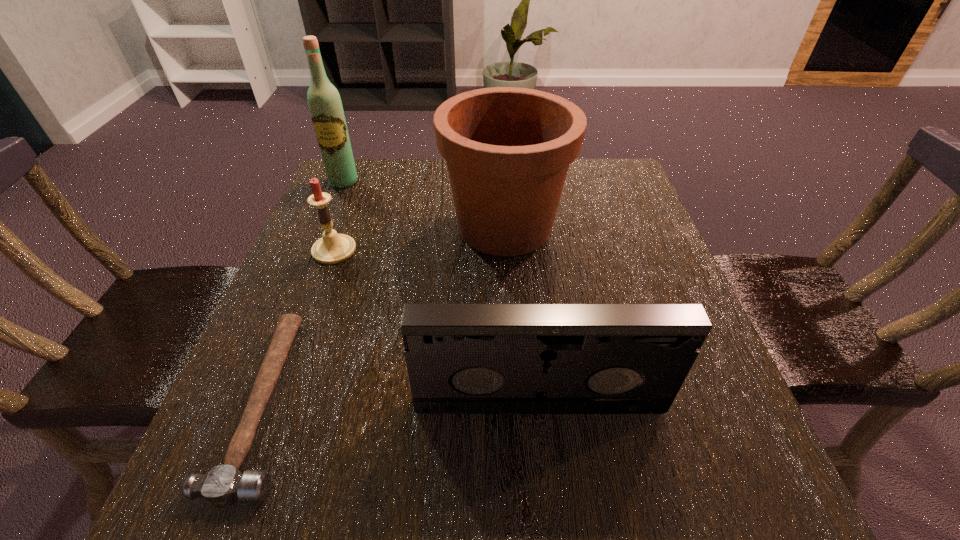
Find the location of a particular element. This screenshot has width=960, height=540. object that stands as the third closest to the wine bottle is located at coordinates pos(223,485).

Identify which object is the second closest to the shortest object. Please provide its 2D coordinates. Your answer should be formatted as a tuple, i.e. [(x, y)], where the tuple contains the x and y coordinates of a point satisfying the conditions above.

[(461, 358)]

Locate an element on the screen. The height and width of the screenshot is (540, 960). vacant space that satisfies the following two spatial constraints: 1. on the front-facing side of the candle; 2. on the right side of the farthest object is located at coordinates (316, 250).

Find the location of a particular element. The height and width of the screenshot is (540, 960). vacant region that satisfies the following two spatial constraints: 1. on the front-facing side of the second tallest object; 2. on the right side of the wine bottle is located at coordinates (325, 227).

Where is `vacant region that satisfies the following two spatial constraints: 1. on the front-facing side of the farthest object; 2. on the left side of the candle`? This screenshot has width=960, height=540. vacant region that satisfies the following two spatial constraints: 1. on the front-facing side of the farthest object; 2. on the left side of the candle is located at coordinates (316, 250).